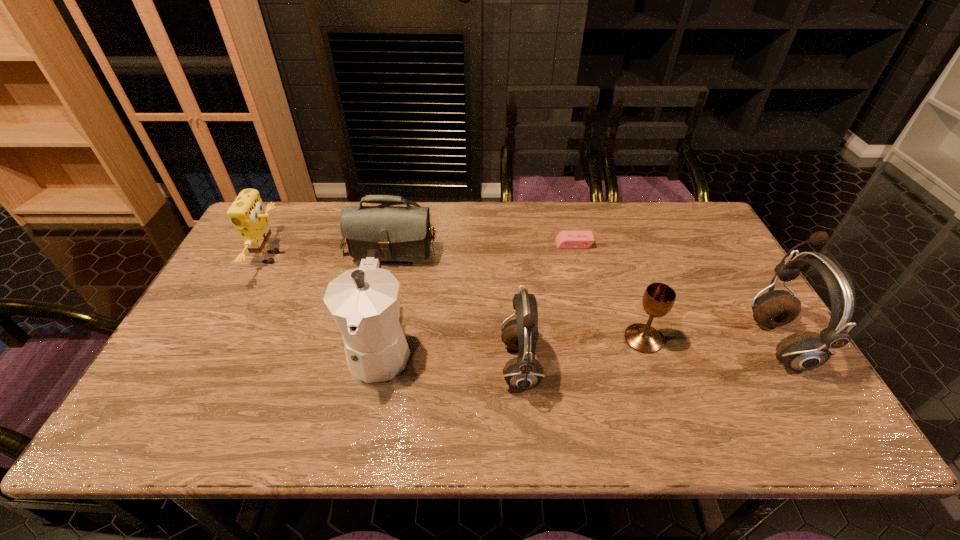
I want to click on the shorter earphone, so click(524, 372).

Locate an element on the screen. The height and width of the screenshot is (540, 960). the fourth object from left to right is located at coordinates pos(524,372).

Find the location of `the right earphone`. the right earphone is located at coordinates (807, 350).

Locate an element on the screen. the rightmost object is located at coordinates (807, 350).

In order to click on shoulder bag in this screenshot , I will do `click(399, 233)`.

Identify the location of chalice. (658, 299).

Locate an element on the screen. The height and width of the screenshot is (540, 960). the sixth object from left to right is located at coordinates (658, 299).

Locate an element on the screen. the leftmost object is located at coordinates (246, 213).

Image resolution: width=960 pixels, height=540 pixels. I want to click on the shortest object, so click(x=565, y=239).

What are the coordinates of `the third object from right to left` in the screenshot? It's located at (565, 239).